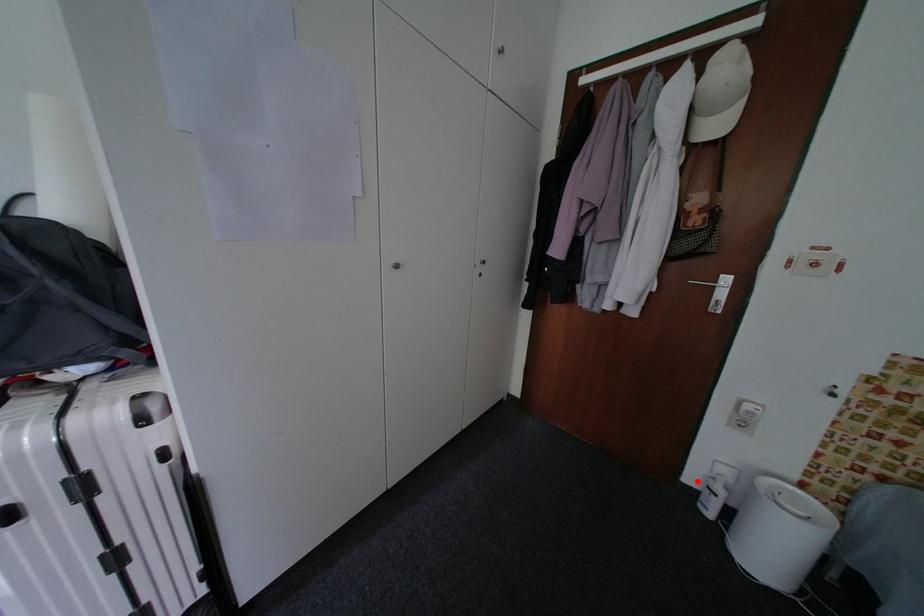
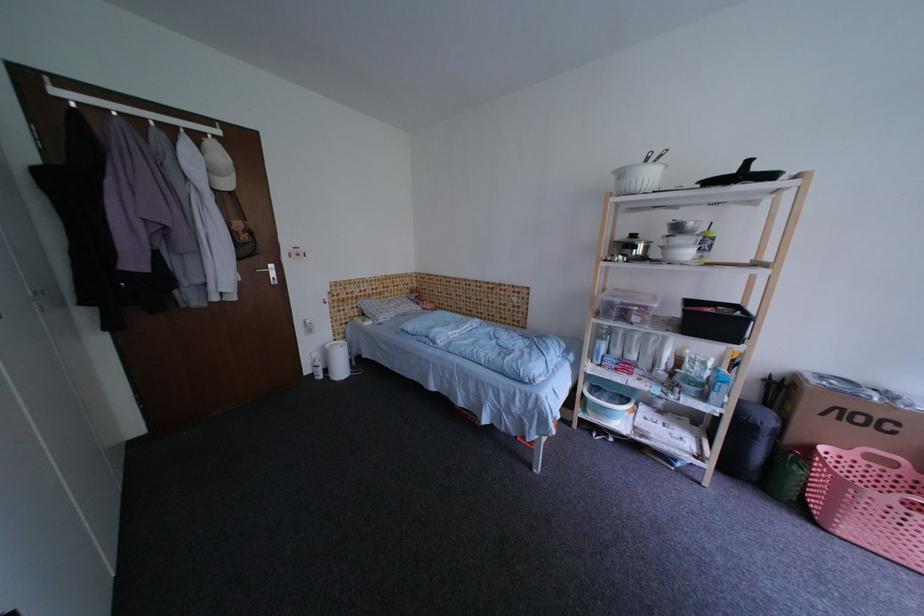
Question: I am providing you with two images of the same scene from different viewpoints. Given a red point in image1, look at the same physical point in image2. Is it:

Choices:
 (A) Closer to the viewpoint
 (B) Farther from the viewpoint

Answer: (A)